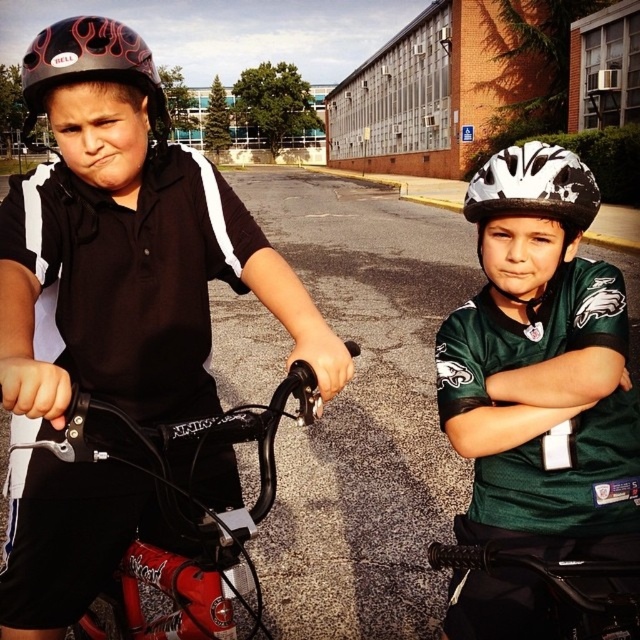
Measure the distance between point (124, 220) and camera.

They are 1.37 meters apart.

Between matte black helmet at upper left and black matte handlebar at center, which one has less height?

black matte handlebar at center

Is point (118, 113) farther from viewer compared to point (289, 310)?

No, it is in front of (289, 310).

Locate an element on the screen. Image resolution: width=640 pixels, height=640 pixels. matte black helmet at upper left is located at coordinates (125, 248).

Which is above, black matte helmet at upper left or black matte handlebar at center?

Positioned higher is black matte helmet at upper left.

Where is `black matte helmet at upper left`? Image resolution: width=640 pixels, height=640 pixels. black matte helmet at upper left is located at coordinates (90, 67).

Does green matte jersey at center have a smaller size compared to black matte arm at center?

No.

What do you see at coordinates (541, 369) in the screenshot? I see `green matte jersey at center` at bounding box center [541, 369].

The width and height of the screenshot is (640, 640). What do you see at coordinates (541, 369) in the screenshot?
I see `green matte jersey at center` at bounding box center [541, 369].

You are a GUI agent. You are given a task and a screenshot of the screen. Output one action in this format:
    pyautogui.click(x=<x>, y=<y>)
    Task: Click on the green matte jersey at center
    This screenshot has width=640, height=640.
    Given the screenshot: What is the action you would take?
    pyautogui.click(x=541, y=369)